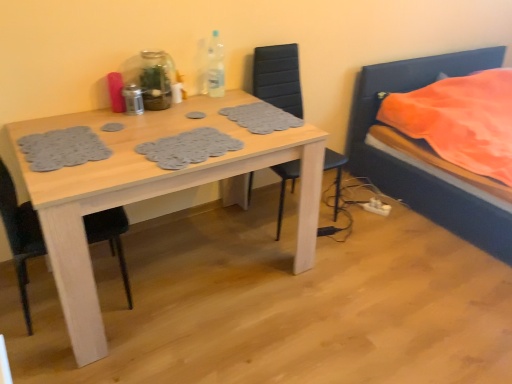
Question: Is clear plastic bottle at upper center, which is the third bottle from left to right, wider or thinner than transparent glass bottle at upper center, which ranks as the 2th bottle in right-to-left order?

Choices:
 (A) wide
 (B) thin

Answer: (B)

Question: From a real-world perspective, relative to transparent glass bottle at upper center, which ranks as the 2th bottle in left-to-right order, is clear plastic bottle at upper center, the first bottle positioned from the right, vertically above or below?

Choices:
 (A) above
 (B) below

Answer: (A)

Question: Which object is positioned closest to the black leather chair at center, marked as the 2th chair in a left-to-right arrangement?

Choices:
 (A) orange fabric bed at right
 (B) clear plastic bottle at upper center, the first bottle positioned from the right
 (C) transparent glass bottle at upper center, which ranks as the 2th bottle in left-to-right order
 (D) black matte chair at left, which ranks as the 1th chair in left-to-right order
 (E) light wood table at center

Answer: (B)

Question: Which object is the farthest from the white plastic power plugs and sockets at lower right?

Choices:
 (A) clear plastic bottle at upper center, which is the third bottle from left to right
 (B) black matte chair at left, which ranks as the 1th chair in left-to-right order
 (C) black leather chair at center, which ranks as the first chair in right-to-left order
 (D) transparent glass bottle at upper center, which ranks as the 2th bottle in left-to-right order
 (E) metallic silver shaker at table center, acting as the 1th bottle starting from the left

Answer: (B)